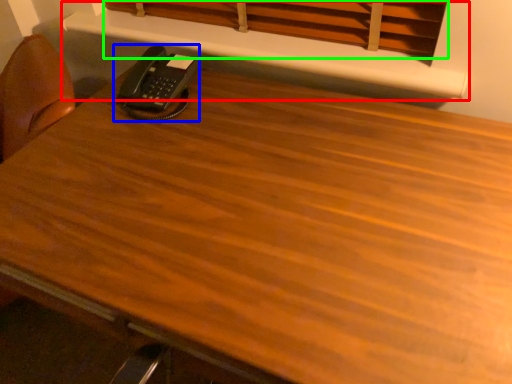
Question: Which is nearer to the shelf (highlighted by a red box)? corded phone (highlighted by a blue box) or curtain (highlighted by a green box).

Choices:
 (A) corded phone
 (B) curtain

Answer: (B)